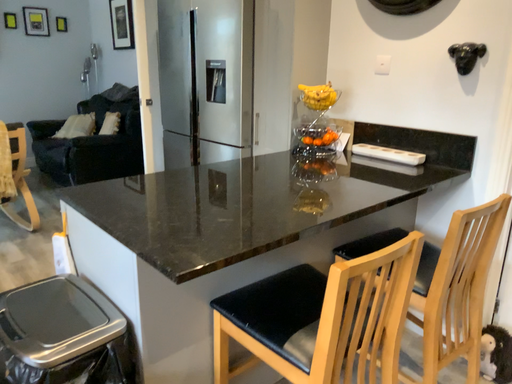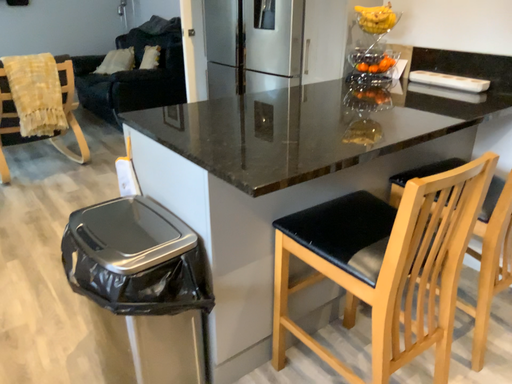
Question: How did the camera likely rotate when shooting the video?

Choices:
 (A) rotated downward
 (B) rotated upward

Answer: (A)